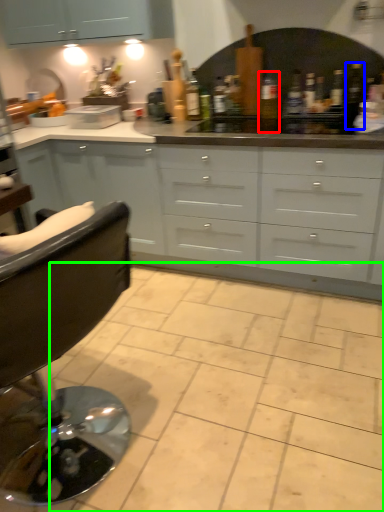
Question: Based on their relative distances, which object is nearer to bottle (highlighted by a red box)? Choose from bottle (highlighted by a blue box) and ceramic tile (highlighted by a green box).

Choices:
 (A) bottle
 (B) ceramic tile

Answer: (A)